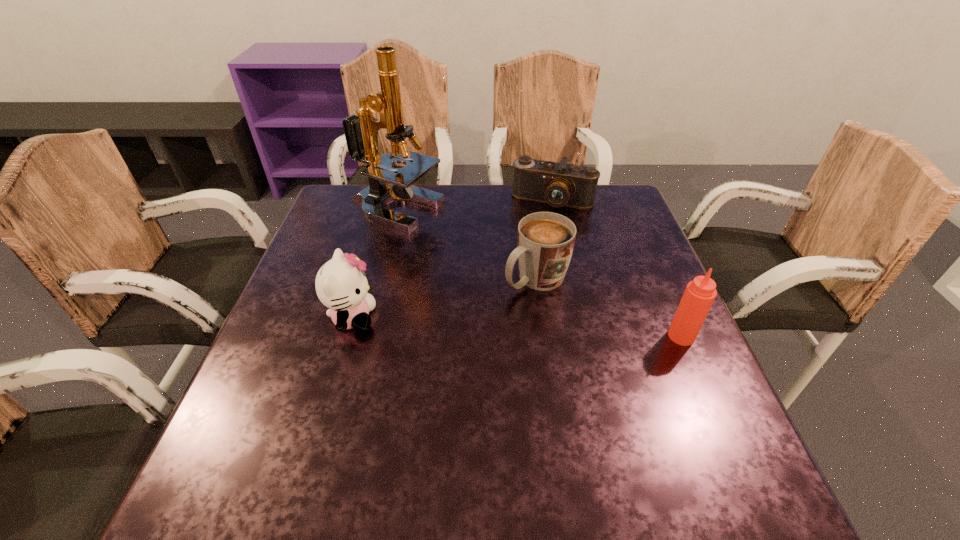
The height and width of the screenshot is (540, 960). I want to click on free space between the kitten and the mug, so click(444, 299).

The image size is (960, 540). Find the location of `free space between the shortest object and the tallest object`. free space between the shortest object and the tallest object is located at coordinates (474, 206).

Locate an element on the screen. vacant area that lies between the kitten and the Tabasco sauce is located at coordinates coord(516,327).

The width and height of the screenshot is (960, 540). Find the location of `empty space between the tallest object and the shortest object`. empty space between the tallest object and the shortest object is located at coordinates (474, 206).

Image resolution: width=960 pixels, height=540 pixels. I want to click on vacant space in between the microscope and the mug, so click(x=466, y=245).

You are a GUI agent. You are given a task and a screenshot of the screen. Output one action in this format:
    pyautogui.click(x=<x>, y=<y>)
    Task: Click on the vacant space in between the kitten and the shortest object
    The width and height of the screenshot is (960, 540).
    Given the screenshot: What is the action you would take?
    pyautogui.click(x=452, y=260)

Select which object is the closest to the mug. Please provide its 2D coordinates. Your answer should be formatted as a tuple, i.e. [(x, y)], where the tuple contains the x and y coordinates of a point satisfying the conditions above.

[(361, 132)]

Find the location of `object that stands as the second closest to the Tabasco sauce`. object that stands as the second closest to the Tabasco sauce is located at coordinates (560, 184).

Locate an element on the screen. blank space that satisfies the following two spatial constraints: 1. on the front side of the rightmost object; 2. on the right side of the camera is located at coordinates tap(583, 336).